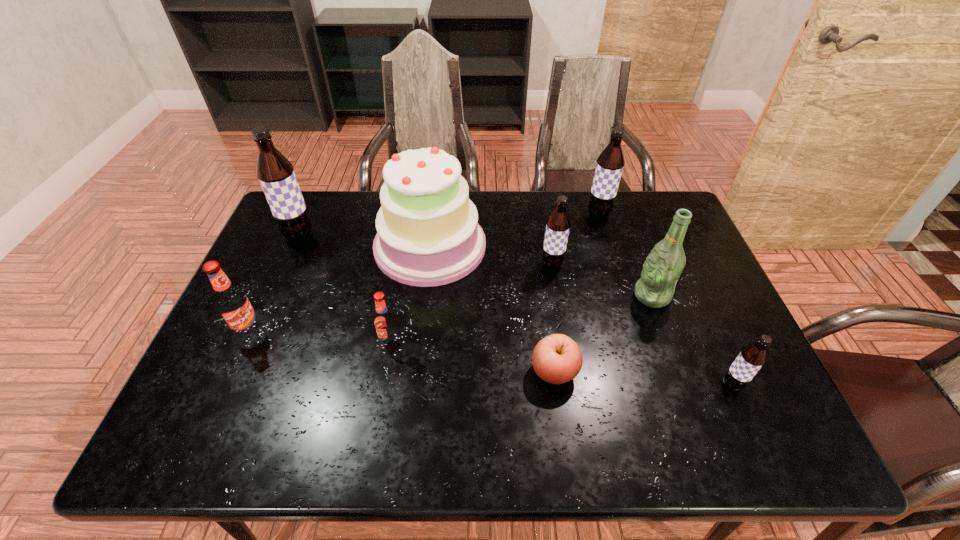
This screenshot has width=960, height=540. In order to click on vacant region at the far edge in this screenshot , I will do coord(494,197).

Where is `vacant space at the near edge`? vacant space at the near edge is located at coordinates (484, 441).

The height and width of the screenshot is (540, 960). In order to click on free spot at the left edge of the desktop in this screenshot , I will do `click(305, 246)`.

Where is `blank space at the right edge`? The image size is (960, 540). blank space at the right edge is located at coordinates (690, 307).

You are a GUI agent. You are given a task and a screenshot of the screen. Output one action in this format:
    pyautogui.click(x=<x>, y=<y>)
    Task: Click on the blank space at the near left corner of the desktop
    
    Given the screenshot: What is the action you would take?
    pyautogui.click(x=219, y=440)

Where is `vacant space at the far right corner`? vacant space at the far right corner is located at coordinates (649, 198).

In the image, there is a desktop. Identify the location of vacant region at the near right corner. The width and height of the screenshot is (960, 540). (774, 438).

Where is `empty space that is in between the farthest root beer and the right red root beer`? empty space that is in between the farthest root beer and the right red root beer is located at coordinates (494, 278).

This screenshot has height=540, width=960. Find the location of `free spot between the green beer bottle and the bigger red root beer`. free spot between the green beer bottle and the bigger red root beer is located at coordinates 451,314.

Identify the location of free spot between the bigger red root beer and the cake. (340, 289).